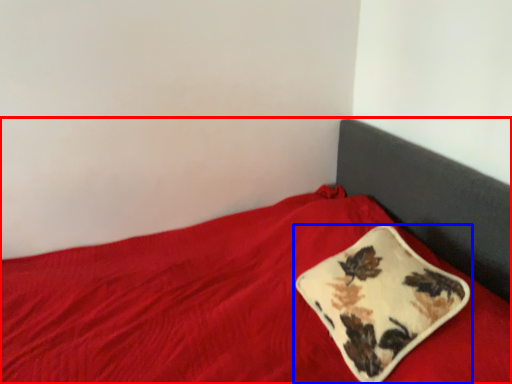
Question: Which of the following is the closest to the observer, bed (highlighted by a red box) or pillow (highlighted by a blue box)?

Choices:
 (A) bed
 (B) pillow

Answer: (A)